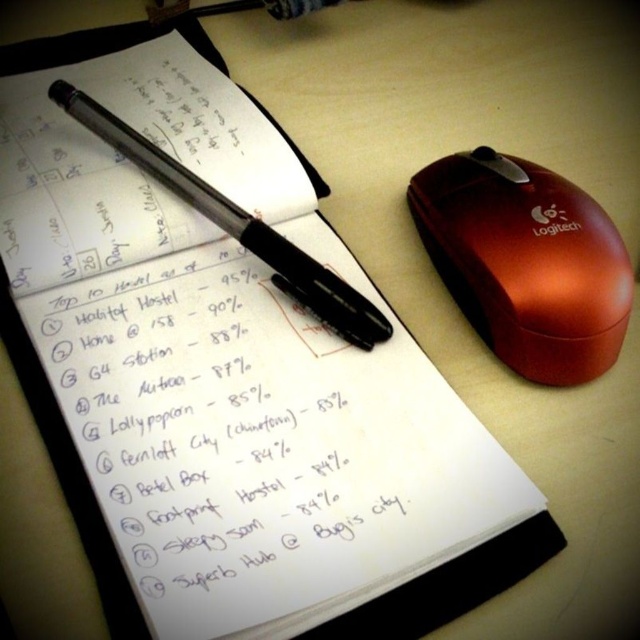
You are organizing your desk and need to place a new sticky note. You want to place it in a spot that is above both the white handwritten text at center and the shiny red mouse at right. Is there enough vertical space between them to fit the sticky note?

The white handwritten text at center is taller than the shiny red mouse at right, so there is vertical space between them. However, since the exact distance isn not provided, it is uncertain if the sticky note will fit.

You are organizing your desk and want to place a small decorative item between the white handwritten text at center and the black glossy pen at upper left. Considering their sizes, which object should you place the item closer to?

The white handwritten text at center is taller than the black glossy pen at upper left, so the decorative item should be placed closer to the black glossy pen at upper left to maintain balance.

You are organizing your desk and want to place a new item between the white handwritten text at center and the shiny red mouse at right. Where should you place it?

You should place the new item between the white handwritten text at center and the shiny red mouse at right, to the right of the white handwritten text at center and to the left of the shiny red mouse at right since the white handwritten text at center is to the left of the shiny red mouse at right.